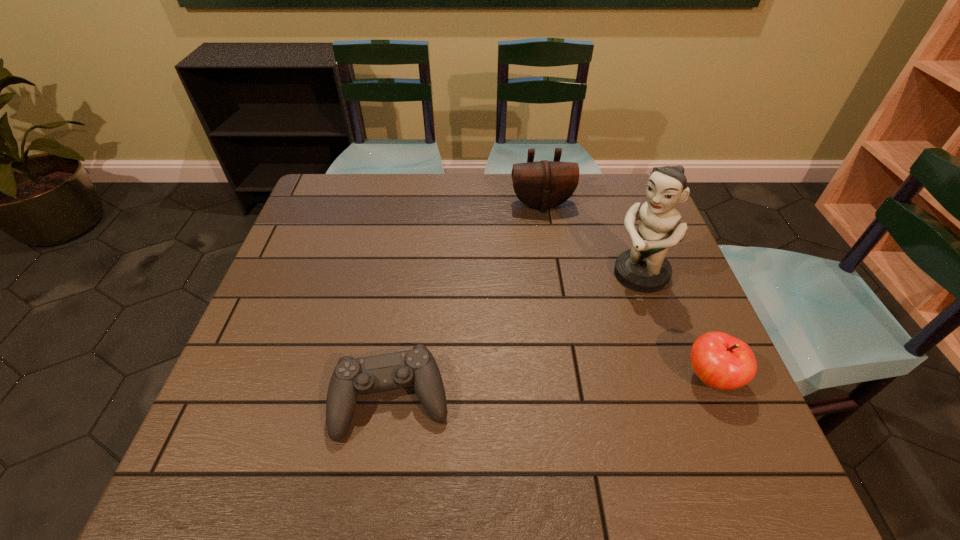
At what (x,y) coordinates should I click in order to perform the action: click on the leftmost object. Please return your answer as a coordinate pair (x, y). Looking at the image, I should click on (417, 367).

The image size is (960, 540). In order to click on the shortest object in this screenshot , I will do `click(417, 367)`.

Where is `apple`? The height and width of the screenshot is (540, 960). apple is located at coordinates click(x=721, y=361).

The width and height of the screenshot is (960, 540). I want to click on the third shortest object, so (544, 184).

The height and width of the screenshot is (540, 960). What are the coordinates of `the third object from right to left` in the screenshot? It's located at (544, 184).

The image size is (960, 540). What are the coordinates of `the third nearest object` in the screenshot? It's located at (643, 268).

The height and width of the screenshot is (540, 960). I want to click on the tallest object, so click(x=643, y=268).

The width and height of the screenshot is (960, 540). What are the coordinates of `vacant space located 0.080m on the right of the shortest object` in the screenshot? It's located at (489, 400).

Where is `vacant region located 0.350m on the left of the second shortest object`? The image size is (960, 540). vacant region located 0.350m on the left of the second shortest object is located at coordinates (517, 378).

What are the coordinates of `blank space located 0.140m with the flap open on the pouch` in the screenshot? It's located at (552, 245).